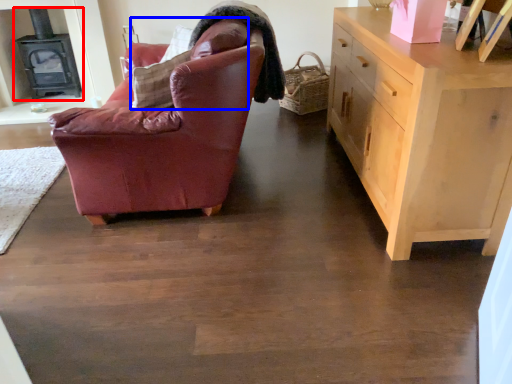
Question: Which object is closer to the camera taking this photo, fireplace (highlighted by a red box) or pillow (highlighted by a blue box)?

Choices:
 (A) fireplace
 (B) pillow

Answer: (B)